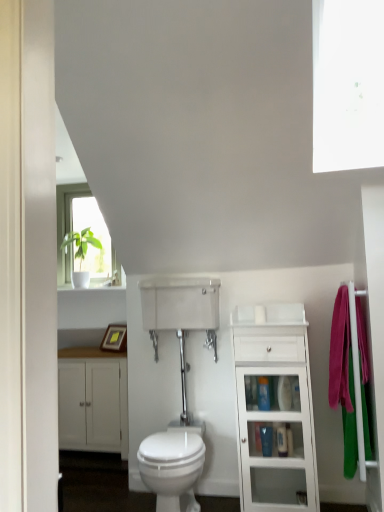
Question: Considering the relative sizes of blue plastic bottle at center, which is the first toiletry from bottom to top, and white matte cabinet at lower left, placed as the 2th bathroom cabinet when sorted from front to back, in the image provided, is blue plastic bottle at center, which is the first toiletry from bottom to top, smaller than white matte cabinet at lower left, placed as the 2th bathroom cabinet when sorted from front to back,?

Choices:
 (A) no
 (B) yes

Answer: (B)

Question: From a real-world perspective, is blue plastic bottle at center, which is the first toiletry from bottom to top, beneath white matte cabinet at lower left, placed as the 2th bathroom cabinet when sorted from front to back?

Choices:
 (A) no
 (B) yes

Answer: (B)

Question: Does blue plastic bottle at center, the third toiletry from the top, have a greater height compared to white matte cabinet at lower left, which appears as the 1th bathroom cabinet when viewed from the left?

Choices:
 (A) no
 (B) yes

Answer: (A)

Question: Is blue plastic bottle at center, the third toiletry from the top, at the right side of white matte cabinet at lower left, placed as the second bathroom cabinet when sorted from right to left?

Choices:
 (A) yes
 (B) no

Answer: (A)

Question: Does blue plastic bottle at center, which is the first toiletry from bottom to top, contain white matte cabinet at lower left, placed as the second bathroom cabinet when sorted from right to left?

Choices:
 (A) no
 (B) yes

Answer: (A)

Question: From their relative heights in the image, would you say blue plastic bottle at center, the 2th toiletry viewed from the top, is taller or shorter than blue plastic bottle at center, which is the first toiletry from bottom to top?

Choices:
 (A) tall
 (B) short

Answer: (A)

Question: Considering their positions, is blue plastic bottle at center, the 2th toiletry viewed from the top, located in front of or behind blue plastic bottle at center, which is the first toiletry from bottom to top?

Choices:
 (A) behind
 (B) front

Answer: (B)

Question: Considering the positions of point (264, 435) and point (284, 431), is point (264, 435) closer or farther from the camera than point (284, 431)?

Choices:
 (A) closer
 (B) farther

Answer: (A)

Question: Do you think blue plastic bottle at center, the 2th toiletry viewed from the top, is within blue plastic bottle at center, the third toiletry from the top, or outside of it?

Choices:
 (A) outside
 (B) inside

Answer: (A)

Question: Considering the positions of point (177, 466) and point (317, 163), is point (177, 466) closer or farther from the camera than point (317, 163)?

Choices:
 (A) farther
 (B) closer

Answer: (B)

Question: Considering the relative positions of white glossy bidet at center and transparent glass window screen at upper right in the image provided, is white glossy bidet at center to the left or to the right of transparent glass window screen at upper right?

Choices:
 (A) right
 (B) left

Answer: (B)

Question: In terms of width, does white glossy bidet at center look wider or thinner when compared to transparent glass window screen at upper right?

Choices:
 (A) wide
 (B) thin

Answer: (A)

Question: From the image's perspective, relative to transparent glass window screen at upper right, is white glossy bidet at center above or below?

Choices:
 (A) above
 (B) below

Answer: (B)

Question: Do you think transparent glass window screen at upper right is within blue plastic bottle at center, which is the first toiletry from bottom to top, or outside of it?

Choices:
 (A) inside
 (B) outside

Answer: (B)

Question: Considering the positions of point coord(312,120) and point coord(281,437), is point coord(312,120) closer or farther from the camera than point coord(281,437)?

Choices:
 (A) closer
 (B) farther

Answer: (A)